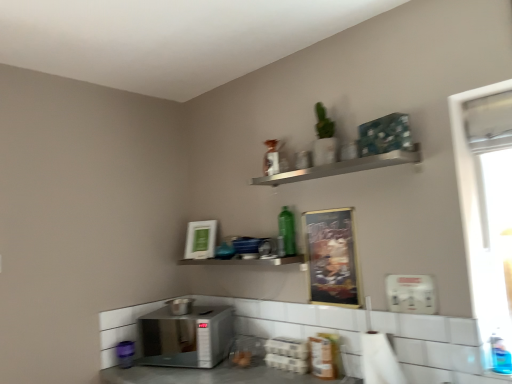
Question: Should I look upward or downward to see satin silver microwave at lower center, which appears as the 2th appliance when viewed from the back?

Choices:
 (A) up
 (B) down

Answer: (B)

Question: Does white plastic dispenser at lower right, which is counted as the 1th appliance, starting from the right, turn towards metallic silver shelf at center, the 2th shelf when ordered from top to bottom?

Choices:
 (A) yes
 (B) no

Answer: (B)

Question: Can you confirm if white plastic dispenser at lower right, which is the 1th appliance from front to back, is positioned to the left of metallic silver shelf at center, the 2th shelf when ordered from top to bottom?

Choices:
 (A) yes
 (B) no

Answer: (B)

Question: Is white plastic dispenser at lower right, which appears as the third appliance when ordered from the bottom, with metallic silver shelf at center, the 1th shelf ordered from the bottom?

Choices:
 (A) no
 (B) yes

Answer: (A)

Question: Is white plastic dispenser at lower right, the 3th appliance viewed from the left, not near metallic silver shelf at center, the 2th shelf when ordered from top to bottom?

Choices:
 (A) yes
 (B) no

Answer: (B)

Question: From the image's perspective, is white plastic dispenser at lower right, the 3th appliance viewed from the left, located above metallic silver shelf at center, the 2th shelf when ordered from top to bottom?

Choices:
 (A) no
 (B) yes

Answer: (A)

Question: From a real-world perspective, is white plastic dispenser at lower right, the 3th appliance from the back, on metallic silver shelf at center, the 2th shelf when ordered from top to bottom?

Choices:
 (A) yes
 (B) no

Answer: (B)

Question: From the image's perspective, would you say satin silver toaster at lower left, which ranks as the 1th appliance in back-to-front order, is positioned over white plastic dispenser at lower right, the 3th appliance viewed from the left?

Choices:
 (A) no
 (B) yes

Answer: (A)

Question: From a real-world perspective, is satin silver toaster at lower left, which ranks as the 2th appliance in top-to-bottom order, on top of white plastic dispenser at lower right, which is the 1th appliance from front to back?

Choices:
 (A) no
 (B) yes

Answer: (A)

Question: Does satin silver toaster at lower left, which ranks as the 1th appliance in back-to-front order, have a greater width compared to white plastic dispenser at lower right, which is the 1th appliance from top to bottom?

Choices:
 (A) no
 (B) yes

Answer: (B)

Question: Is satin silver toaster at lower left, which ranks as the 1th appliance in back-to-front order, facing towards white plastic dispenser at lower right, which appears as the third appliance when ordered from the bottom?

Choices:
 (A) no
 (B) yes

Answer: (A)

Question: Can you confirm if satin silver toaster at lower left, the 1th appliance in the left-to-right sequence, is bigger than white plastic dispenser at lower right, which is counted as the 1th appliance, starting from the right?

Choices:
 (A) no
 (B) yes

Answer: (B)

Question: Could white plastic dispenser at lower right, which appears as the third appliance when ordered from the bottom, be considered to be inside satin silver toaster at lower left, acting as the third appliance starting from the right?

Choices:
 (A) no
 (B) yes

Answer: (A)

Question: Is the depth of green glass bottle at center, which appears as the first bottle when viewed from the left, greater than that of white plastic window screen at right?

Choices:
 (A) no
 (B) yes

Answer: (B)